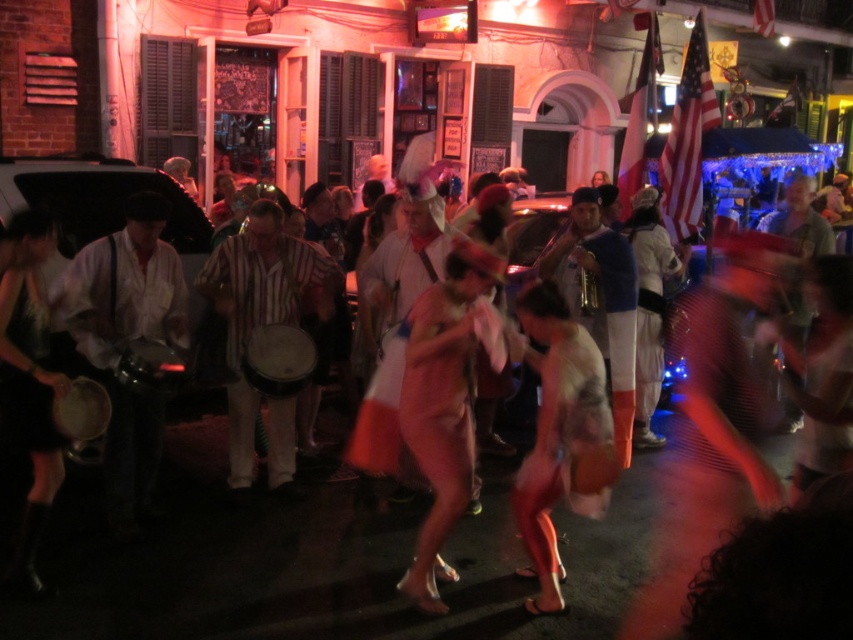
Is point (466, 368) closer to viewer compared to point (260, 333)?

Yes, point (466, 368) is closer to viewer.

Is pink satin dress at center below smooth wooden drum at center?

Yes, pink satin dress at center is below smooth wooden drum at center.

Is point (448, 452) closer to camera compared to point (270, 340)?

Yes, point (448, 452) is in front of point (270, 340).

Identify the location of pink satin dress at center. pyautogui.click(x=442, y=404).

I want to click on pink satin dress at center, so click(442, 404).

Is pink satin dress at center to the left of shiny metallic dress at center from the viewer's perspective?

Indeed, pink satin dress at center is positioned on the left side of shiny metallic dress at center.

The height and width of the screenshot is (640, 853). I want to click on pink satin dress at center, so click(x=442, y=404).

Who is lower down, striped fabric drum at center or black leather dress at left?

Positioned lower is black leather dress at left.

Is striped fabric drum at center to the left of black leather dress at left from the viewer's perspective?

Incorrect, striped fabric drum at center is not on the left side of black leather dress at left.

Find the location of a particular element. The image size is (853, 640). striped fabric drum at center is located at coordinates (260, 307).